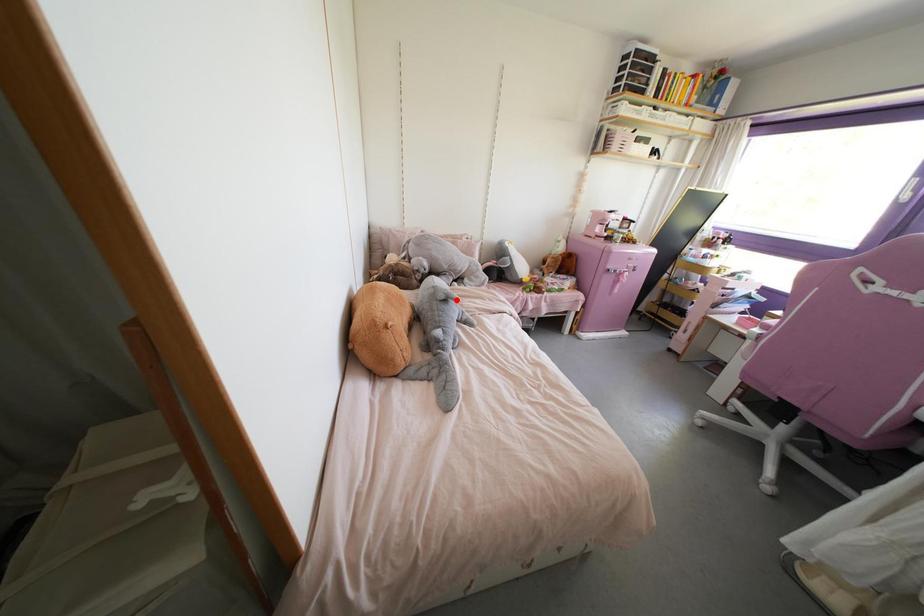
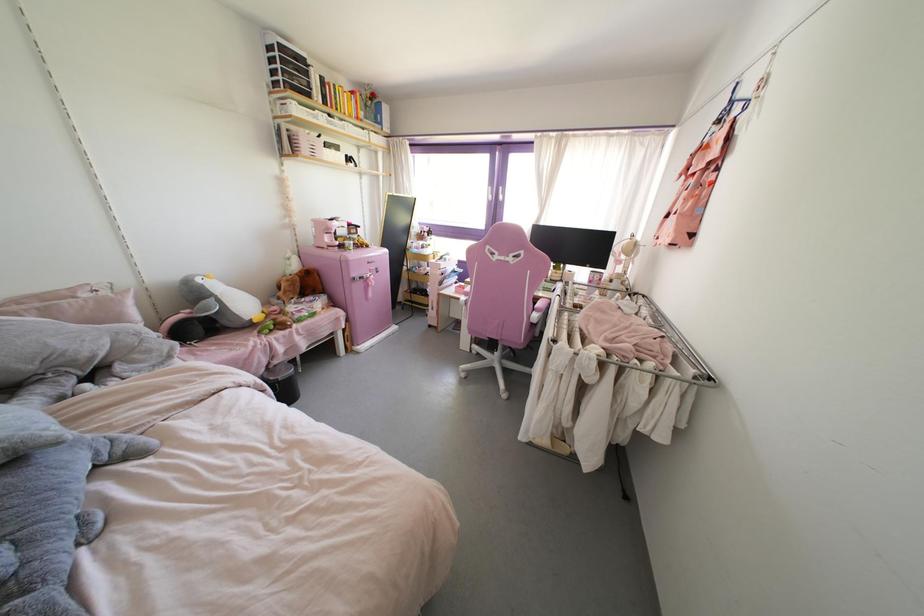
Where in the second image is the point corresponding to the highlighted location from the first image?

(57, 442)